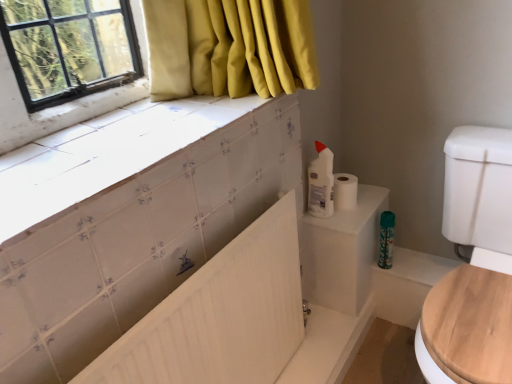
Where is `unoccupied region to the right of green plastic spray bottle at lower right, the 2th cleaning product when ordered from top to bottom`? This screenshot has width=512, height=384. unoccupied region to the right of green plastic spray bottle at lower right, the 2th cleaning product when ordered from top to bottom is located at coordinates (418, 262).